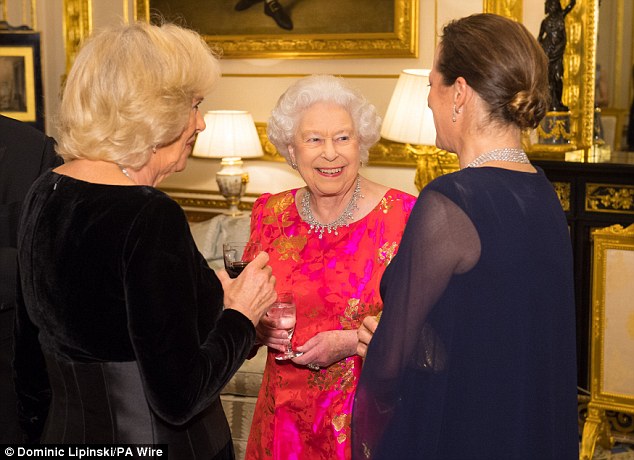
Where is `lamp`? The image size is (634, 460). lamp is located at coordinates (228, 176), (429, 142).